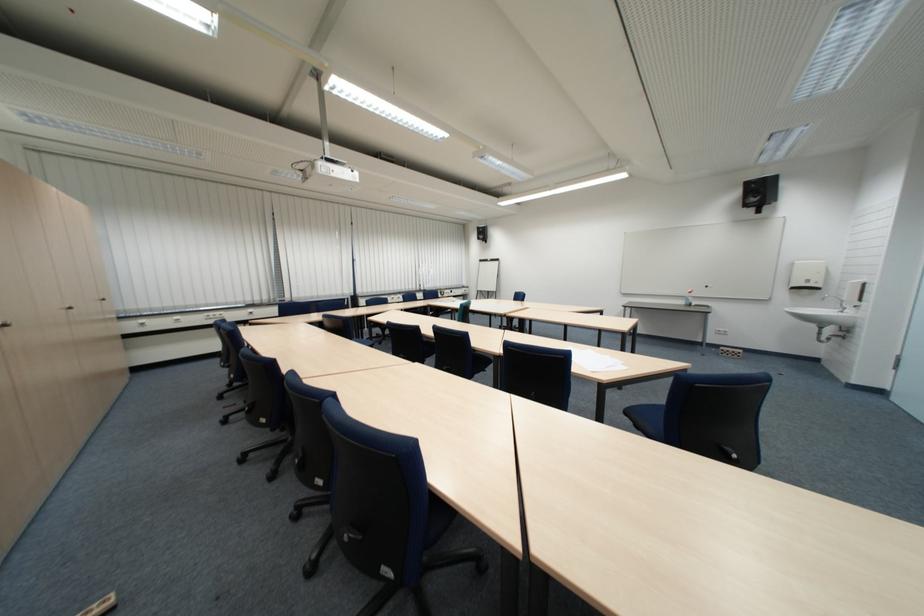
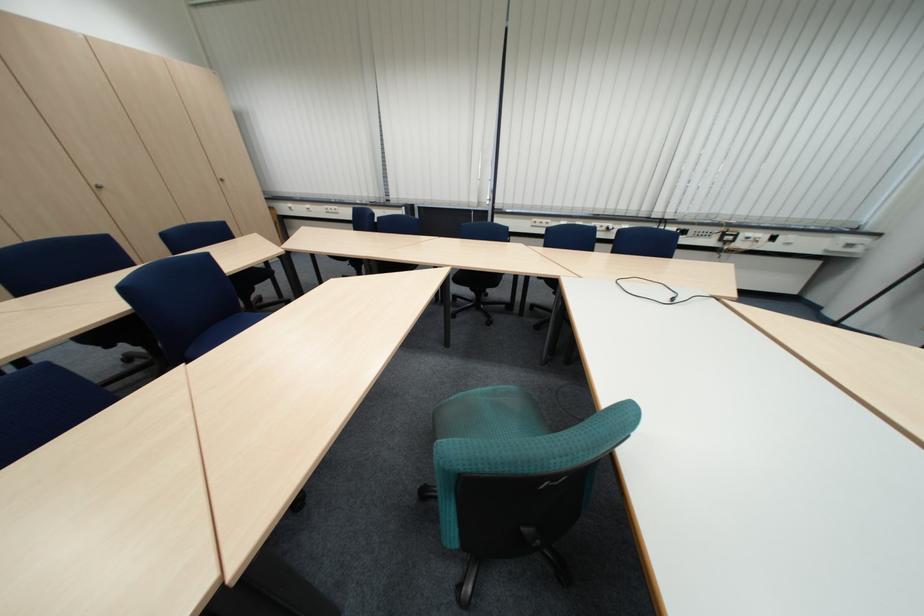
In the second image, find the point that corresponds to point 458,293 in the first image.

(759, 235)